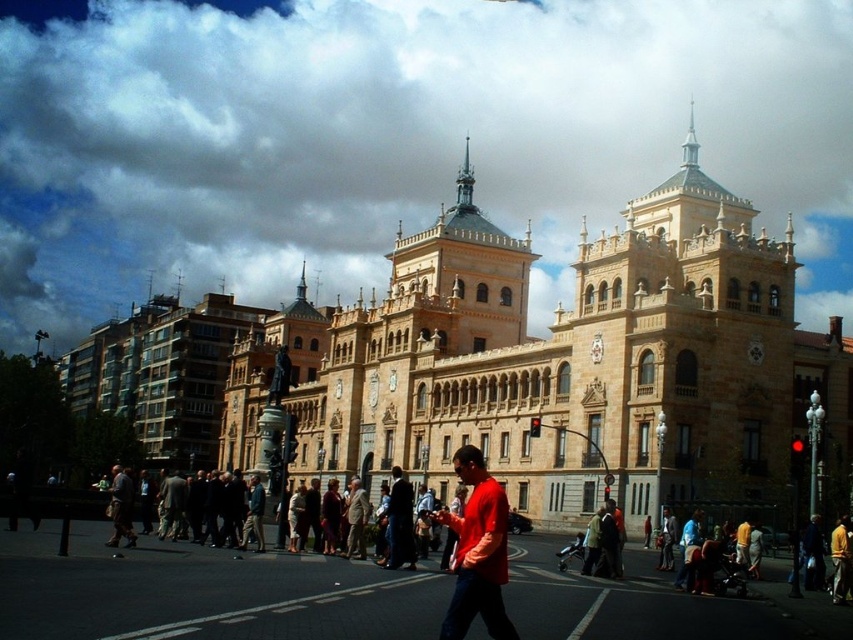
Can you confirm if golden stone palace at center is positioned below dark blue jeans at center?

Actually, golden stone palace at center is above dark blue jeans at center.

Does golden stone palace at center appear on the right side of dark blue jeans at center?

Correct, you'll find golden stone palace at center to the right of dark blue jeans at center.

Between point (563, 323) and point (399, 490), which one is positioned behind?

The point (563, 323) is more distant.

This screenshot has height=640, width=853. In order to click on golden stone palace at center in this screenshot , I will do `click(561, 362)`.

Who is higher up, golden stone palace at center or matte red shirt at center?

Positioned higher is golden stone palace at center.

Between point (639, 432) and point (463, 458), which one is positioned in front?

Point (463, 458) is more forward.

Is point (671, 237) farther from viewer compared to point (474, 518)?

Yes, point (671, 237) is behind point (474, 518).

Where is `golden stone palace at center`? This screenshot has width=853, height=640. golden stone palace at center is located at coordinates (561, 362).

Can you confirm if matte red shirt at center is thinner than dark blue jeans at center?

Indeed, matte red shirt at center has a lesser width compared to dark blue jeans at center.

Can you confirm if matte red shirt at center is positioned to the left of dark blue jeans at center?

Incorrect, matte red shirt at center is not on the left side of dark blue jeans at center.

Who is more forward, (495,620) or (395,497)?

Point (495,620) is in front.

Identify the location of matte red shirt at center. The width and height of the screenshot is (853, 640). (477, 552).